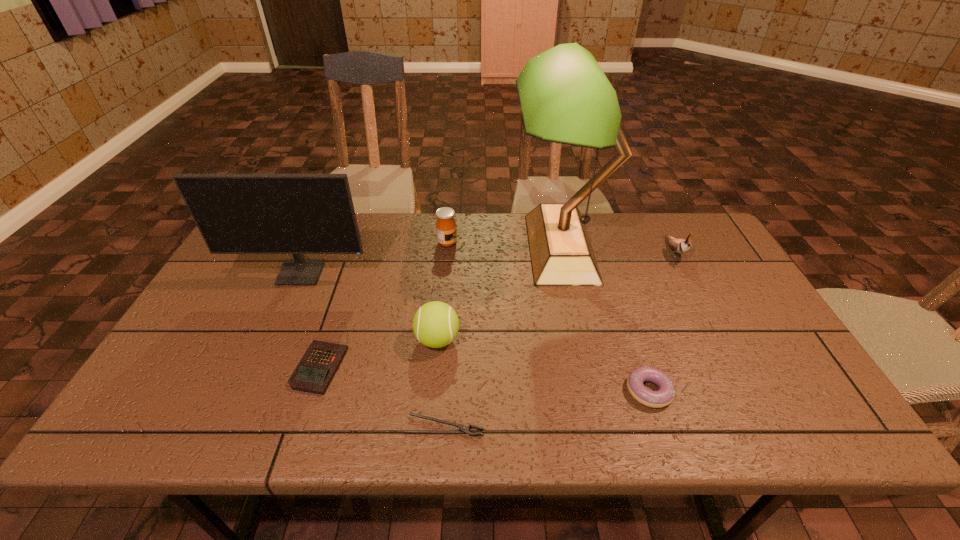
In the image, there is a desktop. Where is `free region at the right edge`? This screenshot has width=960, height=540. free region at the right edge is located at coordinates (738, 352).

Locate an element on the screen. vacant region at the near left corner of the desktop is located at coordinates (159, 436).

Where is `free region at the far right corner of the desktop`? The width and height of the screenshot is (960, 540). free region at the far right corner of the desktop is located at coordinates (684, 239).

Locate an element on the screen. Image resolution: width=960 pixels, height=540 pixels. free space that is in between the seventh shortest object and the tallest object is located at coordinates (431, 261).

Where is `free space that is in between the seventh shortest object and the bird`? This screenshot has width=960, height=540. free space that is in between the seventh shortest object and the bird is located at coordinates (488, 263).

The width and height of the screenshot is (960, 540). I want to click on free space between the third shortest object and the computer monitor, so click(x=475, y=333).

Image resolution: width=960 pixels, height=540 pixels. I want to click on blank region between the table lamp and the doughnut, so click(x=605, y=319).

Locate an element on the screen. The width and height of the screenshot is (960, 540). vacant space in between the tennis ball and the seventh tallest object is located at coordinates (378, 354).

This screenshot has height=540, width=960. I want to click on vacant area that lies between the tallest object and the honey, so click(x=504, y=245).

This screenshot has width=960, height=540. What are the coordinates of `free space between the rightmost object and the tongs` in the screenshot? It's located at (560, 339).